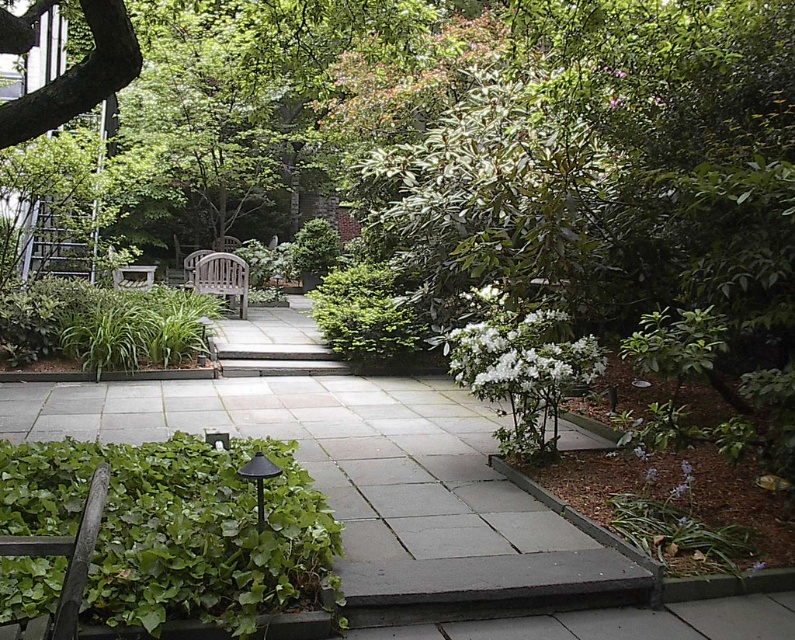
Does gray stone path at center appear on the right side of green leafy bush at center?

No, gray stone path at center is not to the right of green leafy bush at center.

Measure the distance between point (324, 460) and camera.

5.23 meters

Is point (388, 616) positioned in front of point (359, 307)?

Yes, it is.

The image size is (795, 640). Identify the location of gray stone path at center. (370, 483).

Does white matte flower at center-right have a smaller size compared to smooth brown bark at upper left?

No, white matte flower at center-right is not smaller than smooth brown bark at upper left.

What do you see at coordinates (518, 353) in the screenshot?
I see `white matte flower at center-right` at bounding box center [518, 353].

What do you see at coordinates (518, 353) in the screenshot? This screenshot has height=640, width=795. I see `white matte flower at center-right` at bounding box center [518, 353].

Where is `white matte flower at center-right`? This screenshot has height=640, width=795. white matte flower at center-right is located at coordinates (518, 353).

Can you confirm if white matte flower at center-right is wider than teak wood bench at center?

Yes.

You are a GUI agent. You are given a task and a screenshot of the screen. Output one action in this format:
    pyautogui.click(x=<x>, y=<y>)
    Task: Click on the white matte flower at center-right
    The width and height of the screenshot is (795, 640).
    Given the screenshot: What is the action you would take?
    pyautogui.click(x=518, y=353)